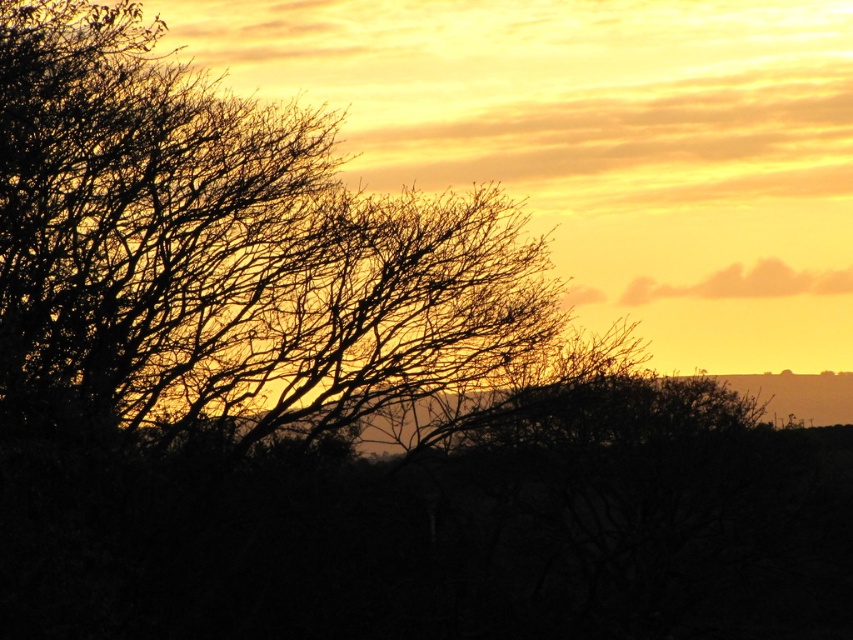
Between silhouette branches at left and cloudy orange sky at upper right, which one appears on the left side from the viewer's perspective?

silhouette branches at left

The width and height of the screenshot is (853, 640). Describe the element at coordinates (242, 259) in the screenshot. I see `silhouette branches at left` at that location.

The width and height of the screenshot is (853, 640). In order to click on silhouette branches at left in this screenshot , I will do `click(242, 259)`.